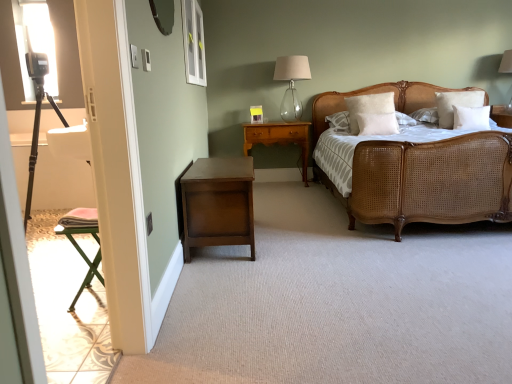
This screenshot has height=384, width=512. Find the location of `vacant area that is in front of dark wood nightstand at lower left, the second nightstand positioned from the back`. vacant area that is in front of dark wood nightstand at lower left, the second nightstand positioned from the back is located at coordinates (257, 276).